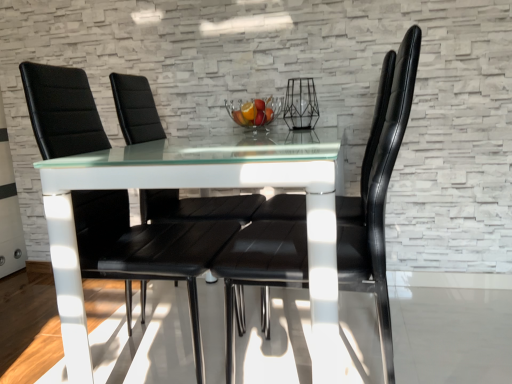
Question: Is point (245, 233) positioned closer to the camera than point (172, 205)?

Choices:
 (A) farther
 (B) closer

Answer: (B)

Question: From a real-world perspective, relative to black leather chair at center, which is counted as the first chair, starting from the back, is black leather chair at center, which ranks as the 3th chair in back-to-front order, vertically above or below?

Choices:
 (A) above
 (B) below

Answer: (A)

Question: Which object is positioned farthest from the black leather chair at center, marked as the 3th chair in a front-to-back arrangement?

Choices:
 (A) black leather chair at center, which is the 1th chair in front-to-back order
 (B) clear glass bowl at center
 (C) black leather chair at center, placed as the second chair when sorted from back to front

Answer: (B)

Question: Estimate the real-world distances between objects in this image. Which object is closer to the black leather chair at center, placed as the second chair when sorted from back to front?

Choices:
 (A) black leather chair at center, which ranks as the 3th chair in back-to-front order
 (B) clear glass bowl at center
 (C) black leather chair at center, marked as the 3th chair in a front-to-back arrangement

Answer: (C)